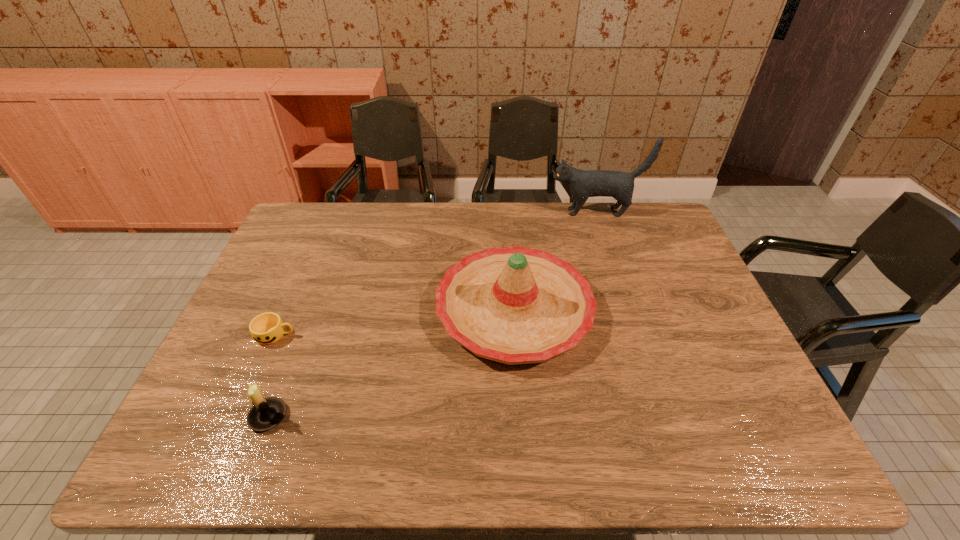
Locate an element on the screen. This screenshot has height=540, width=960. vacant point located between the cup and the farthest object is located at coordinates (436, 274).

I want to click on free space between the candle holder and the sombrero, so click(392, 363).

What are the coordinates of `vacant area that lies between the third shortest object and the nearest object` in the screenshot? It's located at (392, 363).

This screenshot has height=540, width=960. I want to click on object that is the second closest to the tallest object, so click(267, 328).

Point out which object is positioned as the nearest to the cup. Please provide its 2D coordinates. Your answer should be formatted as a tuple, i.e. [(x, y)], where the tuple contains the x and y coordinates of a point satisfying the conditions above.

[(266, 413)]

The width and height of the screenshot is (960, 540). Identify the location of vacant region that satisfies the following two spatial constraints: 1. at the face of the farthest object; 2. on the front side of the cup. (637, 335).

Where is `vacant area that satisfies the following two spatial constraints: 1. at the face of the tallest object; 2. on the front side of the candle holder`? The image size is (960, 540). vacant area that satisfies the following two spatial constraints: 1. at the face of the tallest object; 2. on the front side of the candle holder is located at coordinates (664, 416).